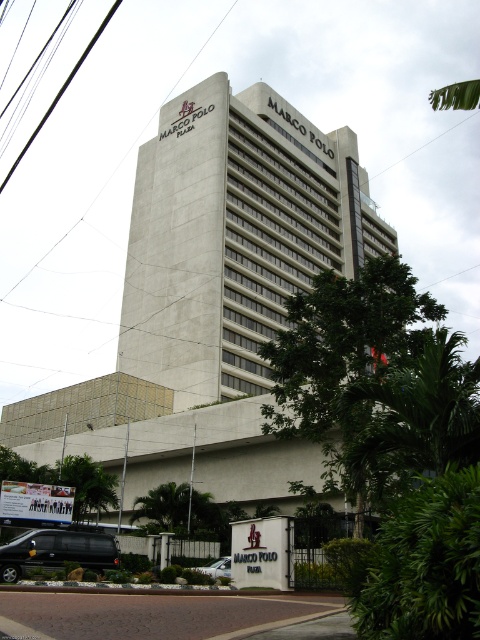
You are a delivery driver and need to park your silver metallic car at lower center near the gray concrete building at center. Considering the building is wider than your car, can you park the car entirely within the building? Explain why or why not.

The gray concrete building at center is wider than the silver metallic car at lower center. However, the car cannot be parked entirely within the building because the building is a structure meant for occupancy, not a parking space. The car would need to be parked in an appropriate parking area outside the building.

You are standing at the entrance of Marco Polo Plaza and want to take a photo of the building. You notice two points marked on the facade at coordinates point (383,220) and point (39,552). Which point is closer to your camera when taking the photo?

Point (39,552) is closer to the camera because it is positioned closer to the entrance where you are standing, while point (383,220) is further away from the camera.

You are standing in front of the Marco Polo Plaza and want to take a photo of the gray concrete building at center and the black matte van at lower left together in the frame. Which direction should you face to include both objects in your photo?

You should face towards the left side of the gray concrete building at center to include both the gray concrete building at center and the black matte van at lower left in the frame, since the gray concrete building at center is located to the right of the black matte van at lower left.